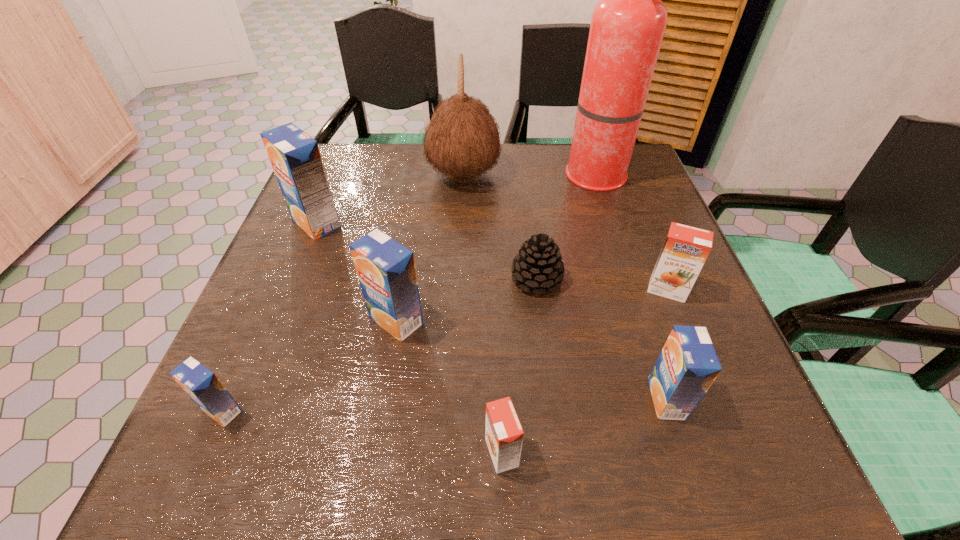
Locate an element on the screen. object present at the far right corner is located at coordinates (627, 27).

Where is `vacant space at the far edge of the desktop`? Image resolution: width=960 pixels, height=540 pixels. vacant space at the far edge of the desktop is located at coordinates (548, 178).

The width and height of the screenshot is (960, 540). Find the location of `vacant region at the near edge of the desktop`. vacant region at the near edge of the desktop is located at coordinates (547, 477).

In the image, there is a desktop. At what (x,y) coordinates should I click in order to perform the action: click on vacant space at the right edge. Please return your answer as a coordinate pair (x, y). This screenshot has height=540, width=960. Looking at the image, I should click on (618, 207).

The height and width of the screenshot is (540, 960). In the image, there is a desktop. Find the location of `free space at the far left corner`. free space at the far left corner is located at coordinates (356, 151).

In the image, there is a desktop. Identify the location of vacant space at the far right corner. (645, 170).

Locate an element on the screen. The height and width of the screenshot is (540, 960). vacant space that's between the second farthest blue orange_juice and the sixth object from left to right is located at coordinates (467, 300).

Where is `empty location between the farthest blue orange_juice and the nearer orange orange juice`? Image resolution: width=960 pixels, height=540 pixels. empty location between the farthest blue orange_juice and the nearer orange orange juice is located at coordinates (409, 338).

Where is `empty space between the bigger orange orange juice and the farthest blue orange_juice`? empty space between the bigger orange orange juice and the farthest blue orange_juice is located at coordinates (492, 256).

Where is `free space between the smallest blue orange_juice and the biggest blue orange_juice`? free space between the smallest blue orange_juice and the biggest blue orange_juice is located at coordinates (269, 316).